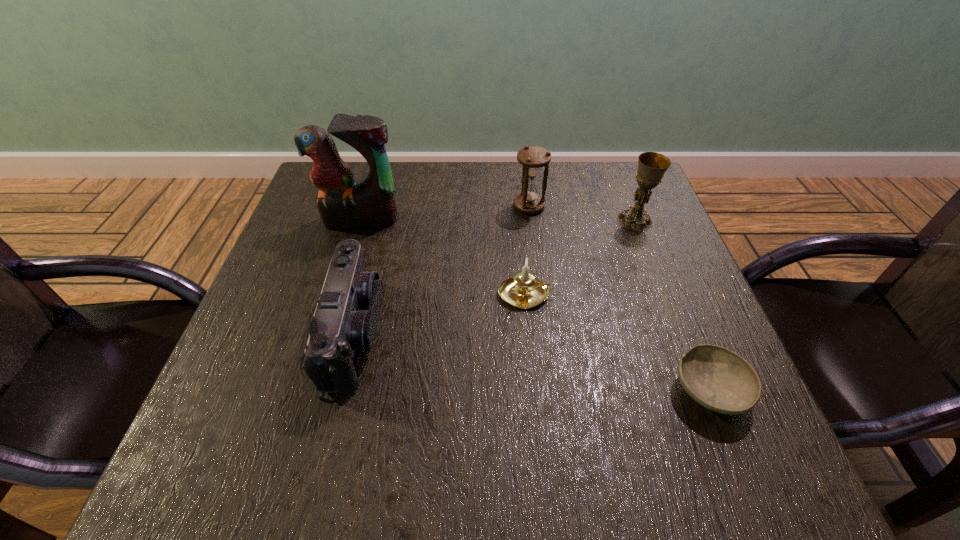
The height and width of the screenshot is (540, 960). What are the coordinates of `parrot` in the screenshot? It's located at (342, 203).

Image resolution: width=960 pixels, height=540 pixels. Find the location of `chalice`. chalice is located at coordinates (652, 166).

Find the location of a particular element. The image size is (960, 540). hourglass is located at coordinates (529, 201).

At what (x,y) coordinates should I click in order to perform the action: click on the third shortest object. Please return your answer as a coordinate pair (x, y). This screenshot has height=540, width=960. Looking at the image, I should click on (344, 324).

At what (x,y) coordinates should I click in order to perform the action: click on candle holder. Please return your answer as a coordinate pair (x, y). The height and width of the screenshot is (540, 960). Looking at the image, I should click on (526, 292).

Where is `the shortest object`? This screenshot has height=540, width=960. the shortest object is located at coordinates (720, 380).

Identify the location of blank space located 0.350m at the face of the parrot. Image resolution: width=960 pixels, height=540 pixels. (321, 356).

This screenshot has height=540, width=960. Identify the location of vacant region located 0.120m on the back of the chalice. (620, 181).

Identify the location of vacant space located on the front of the hourglass. (537, 261).

The image size is (960, 540). In order to click on vacant space situated on the front-facing side of the camcorder in this screenshot , I will do `click(529, 334)`.